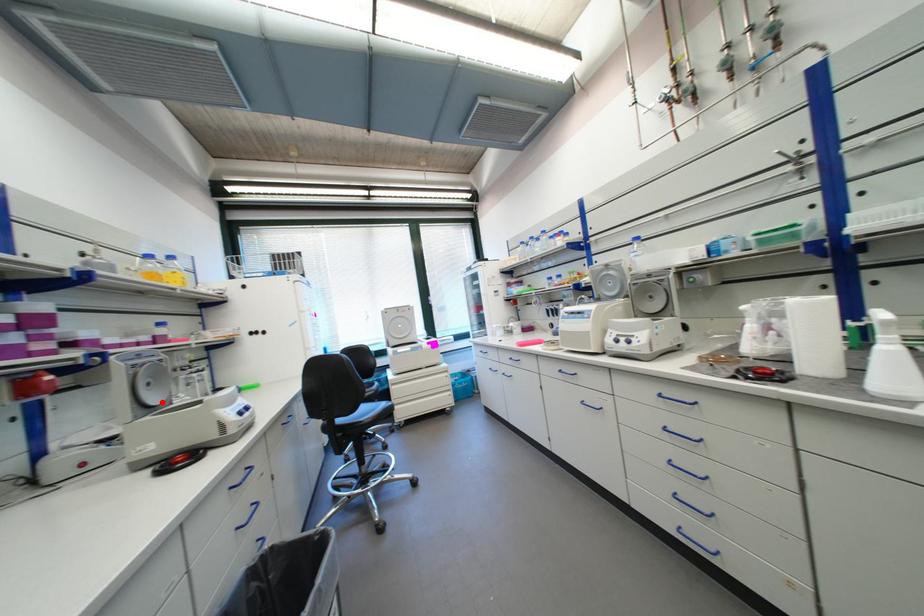
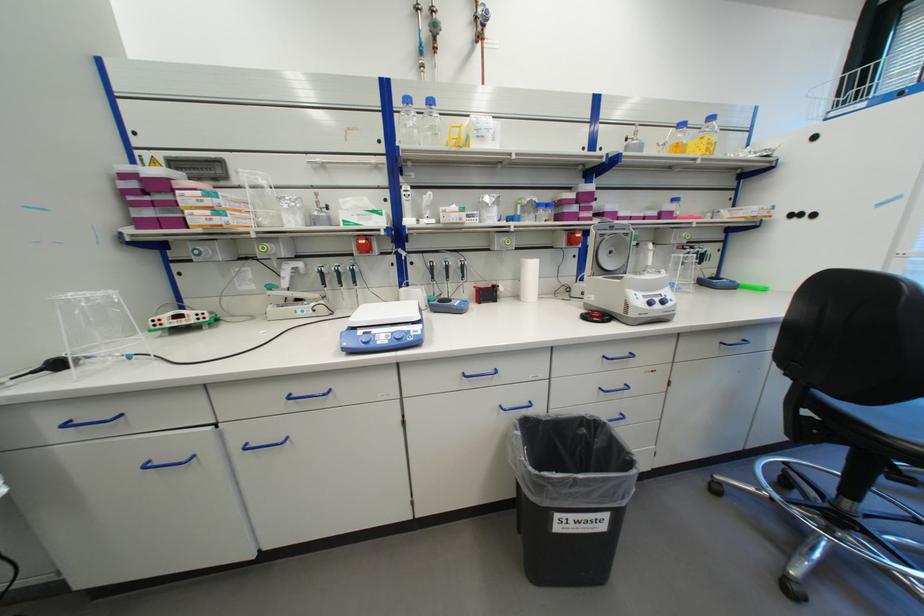
In the second image, find the point that corresponds to the highlighted location in the first image.

(616, 267)